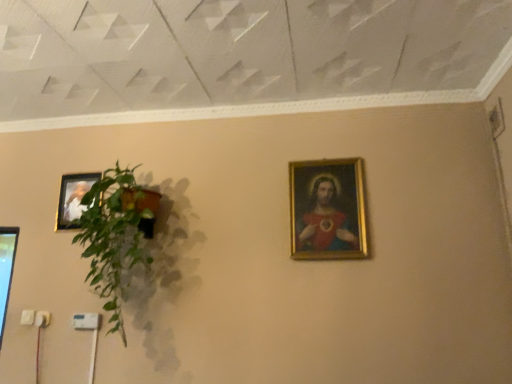
The image size is (512, 384). Find the location of `green leafy plant at left`. green leafy plant at left is located at coordinates (114, 237).

What do you see at coordinates (73, 198) in the screenshot? I see `matte gold picture frame at upper left, the 1th picture frame when ordered from left to right` at bounding box center [73, 198].

Describe the element at coordinates (328, 210) in the screenshot. The image size is (512, 384). I see `gold-framed painting at upper right, the 1th picture frame from the front` at that location.

The image size is (512, 384). Identify the location of green leafy plant at left. (114, 237).

Is there a large distance between green leafy plant at left and gold-framed painting at upper right, the 1th picture frame from the front?

They are positioned close to each other.

Looking at this image, looking at the image, does green leafy plant at left seem bigger or smaller compared to gold-framed painting at upper right, the 1th picture frame from the front?

Considering their sizes, green leafy plant at left takes up more space than gold-framed painting at upper right, the 1th picture frame from the front.

Which of these two, green leafy plant at left or gold-framed painting at upper right, which ranks as the second picture frame in left-to-right order, is wider?

green leafy plant at left is wider.

Could you tell me if green leafy plant at left is turned towards gold-framed painting at upper right, which ranks as the second picture frame in left-to-right order?

No, green leafy plant at left is not oriented towards gold-framed painting at upper right, which ranks as the second picture frame in left-to-right order.

Looking at this image, is gold-framed painting at upper right, positioned as the second picture frame in back-to-front order, smaller than green leafy plant at left?

Correct, gold-framed painting at upper right, positioned as the second picture frame in back-to-front order, occupies less space than green leafy plant at left.

Can green leafy plant at left be found inside gold-framed painting at upper right, positioned as the second picture frame in back-to-front order?

No, green leafy plant at left is not a part of gold-framed painting at upper right, positioned as the second picture frame in back-to-front order.

Which is in front, point (351, 192) or point (122, 220)?

The point (122, 220) is closer to the camera.

Is gold-framed painting at upper right, which is the 1th picture frame from right to left, to the left of green leafy plant at left from the viewer's perspective?

No.

Is gold-framed painting at upper right, which ranks as the second picture frame in left-to-right order, in front of or behind matte gold picture frame at upper left, placed as the 2th picture frame when sorted from right to left, in the image?

gold-framed painting at upper right, which ranks as the second picture frame in left-to-right order, is positioned closer to the viewer than matte gold picture frame at upper left, placed as the 2th picture frame when sorted from right to left.

Which object is positioned more to the right, gold-framed painting at upper right, positioned as the second picture frame in back-to-front order, or matte gold picture frame at upper left, arranged as the first picture frame when viewed from the back?

gold-framed painting at upper right, positioned as the second picture frame in back-to-front order.

Is gold-framed painting at upper right, positioned as the second picture frame in back-to-front order, smaller than matte gold picture frame at upper left, arranged as the first picture frame when viewed from the back?

No, gold-framed painting at upper right, positioned as the second picture frame in back-to-front order, is not smaller than matte gold picture frame at upper left, arranged as the first picture frame when viewed from the back.

Locate an element on the screen. The width and height of the screenshot is (512, 384). houseplant in front of the matte gold picture frame at upper left, marked as the 2th picture frame in a front-to-back arrangement is located at coordinates (114, 237).

Is point (66, 189) farther from camera compared to point (82, 237)?

Yes, point (66, 189) is farther from viewer.

Considering the sizes of objects matte gold picture frame at upper left, placed as the 2th picture frame when sorted from right to left, and green leafy plant at left in the image provided, who is wider, matte gold picture frame at upper left, placed as the 2th picture frame when sorted from right to left, or green leafy plant at left?

green leafy plant at left is wider.

Based on the photo, can you confirm if matte gold picture frame at upper left, marked as the 2th picture frame in a front-to-back arrangement, is smaller than green leafy plant at left?

Yes, matte gold picture frame at upper left, marked as the 2th picture frame in a front-to-back arrangement, is smaller than green leafy plant at left.

Between green leafy plant at left and matte gold picture frame at upper left, placed as the 2th picture frame when sorted from right to left, which one is positioned in front?

green leafy plant at left.

Could you measure the distance between green leafy plant at left and matte gold picture frame at upper left, arranged as the first picture frame when viewed from the back?

green leafy plant at left is 16.08 inches away from matte gold picture frame at upper left, arranged as the first picture frame when viewed from the back.

There is a green leafy plant at left. Where is `the 2nd picture frame above it (from a real-world perspective)`? The height and width of the screenshot is (384, 512). the 2nd picture frame above it (from a real-world perspective) is located at coordinates (73, 198).

From a real-world perspective, is green leafy plant at left under matte gold picture frame at upper left, placed as the 2th picture frame when sorted from right to left?

Yes, from a real-world perspective, green leafy plant at left is under matte gold picture frame at upper left, placed as the 2th picture frame when sorted from right to left.

Who is smaller, matte gold picture frame at upper left, placed as the 2th picture frame when sorted from right to left, or gold-framed painting at upper right, which ranks as the second picture frame in left-to-right order?

With smaller size is matte gold picture frame at upper left, placed as the 2th picture frame when sorted from right to left.

From a real-world perspective, is matte gold picture frame at upper left, arranged as the first picture frame when viewed from the back, on top of gold-framed painting at upper right, the 1th picture frame from the front?

Yes.

Between matte gold picture frame at upper left, the 1th picture frame when ordered from left to right, and gold-framed painting at upper right, positioned as the second picture frame in back-to-front order, which one has smaller width?

Thinner between the two is gold-framed painting at upper right, positioned as the second picture frame in back-to-front order.

Is there a large distance between matte gold picture frame at upper left, marked as the 2th picture frame in a front-to-back arrangement, and gold-framed painting at upper right, positioned as the second picture frame in back-to-front order?

Yes.

Locate an element on the screen. This screenshot has height=384, width=512. houseplant that appears in front of the gold-framed painting at upper right, positioned as the second picture frame in back-to-front order is located at coordinates (114, 237).

At what (x,y) coordinates should I click in order to perform the action: click on picture frame that is the 1st object above the green leafy plant at left (from a real-world perspective). Please return your answer as a coordinate pair (x, y). Looking at the image, I should click on (328, 210).

Considering their positions, is green leafy plant at left positioned further to matte gold picture frame at upper left, the 1th picture frame when ordered from left to right, than gold-framed painting at upper right, which is the 1th picture frame from right to left?

Among the two, gold-framed painting at upper right, which is the 1th picture frame from right to left, is located further to matte gold picture frame at upper left, the 1th picture frame when ordered from left to right.

Based on the photo, considering their positions, is gold-framed painting at upper right, the 1th picture frame from the front, positioned further to green leafy plant at left than matte gold picture frame at upper left, marked as the 2th picture frame in a front-to-back arrangement?

Among the two, gold-framed painting at upper right, the 1th picture frame from the front, is located further to green leafy plant at left.

From the image, which object appears to be nearer to gold-framed painting at upper right, which is the 1th picture frame from right to left, matte gold picture frame at upper left, placed as the 2th picture frame when sorted from right to left, or green leafy plant at left?

Among the two, green leafy plant at left is located nearer to gold-framed painting at upper right, which is the 1th picture frame from right to left.

Looking at this image, considering their positions, is gold-framed painting at upper right, which ranks as the second picture frame in left-to-right order, positioned further to matte gold picture frame at upper left, the 1th picture frame when ordered from left to right, than green leafy plant at left?

Based on the image, gold-framed painting at upper right, which ranks as the second picture frame in left-to-right order, appears to be further to matte gold picture frame at upper left, the 1th picture frame when ordered from left to right.

When comparing their distances from green leafy plant at left, does matte gold picture frame at upper left, placed as the 2th picture frame when sorted from right to left, or gold-framed painting at upper right, which ranks as the second picture frame in left-to-right order, seem further?

Among the two, gold-framed painting at upper right, which ranks as the second picture frame in left-to-right order, is located further to green leafy plant at left.

Which object lies nearer to the anchor point gold-framed painting at upper right, the 1th picture frame from the front, green leafy plant at left or matte gold picture frame at upper left, placed as the 2th picture frame when sorted from right to left?

Based on the image, green leafy plant at left appears to be nearer to gold-framed painting at upper right, the 1th picture frame from the front.

At what (x,y) coordinates should I click in order to perform the action: click on houseplant situated between matte gold picture frame at upper left, the 1th picture frame when ordered from left to right, and gold-framed painting at upper right, the 1th picture frame from the front, from left to right. Please return your answer as a coordinate pair (x, y). The image size is (512, 384). Looking at the image, I should click on (114, 237).